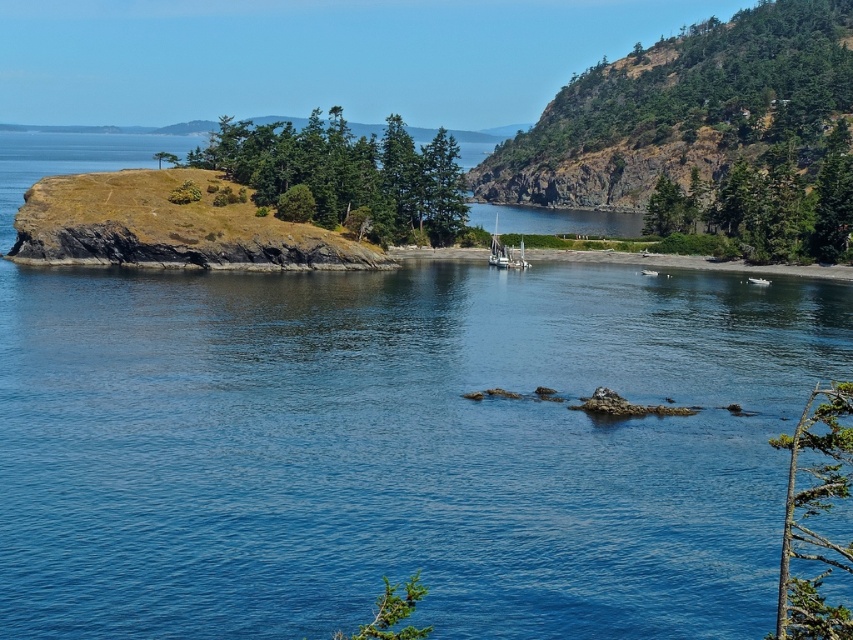
Who is positioned more to the left, clear blue water at center or wooden sailboat at center?

clear blue water at center

Looking at this image, can you confirm if clear blue water at center is shorter than wooden sailboat at center?

No, clear blue water at center is not shorter than wooden sailboat at center.

What do you see at coordinates (397, 449) in the screenshot? This screenshot has width=853, height=640. I see `clear blue water at center` at bounding box center [397, 449].

Find the location of `clear blue water at center`. clear blue water at center is located at coordinates (397, 449).